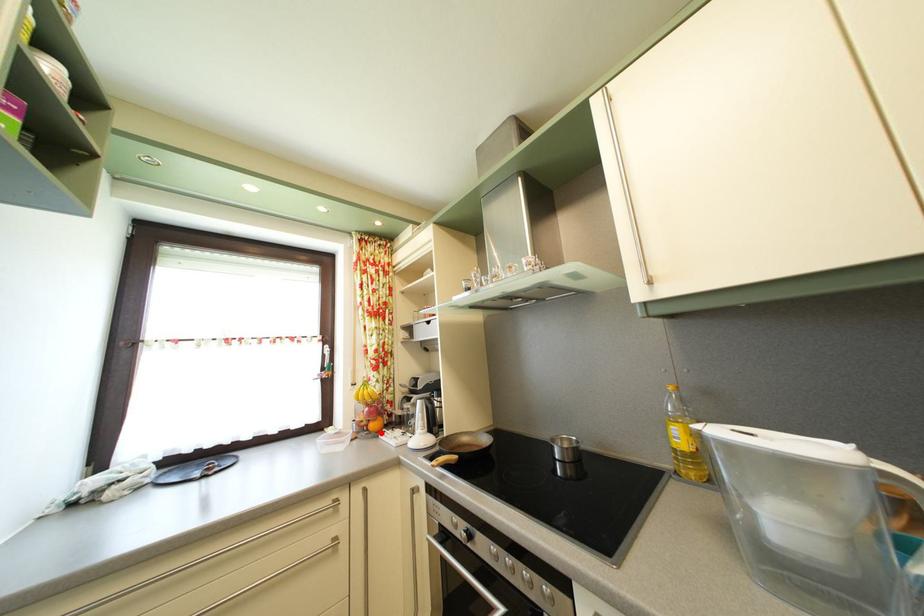
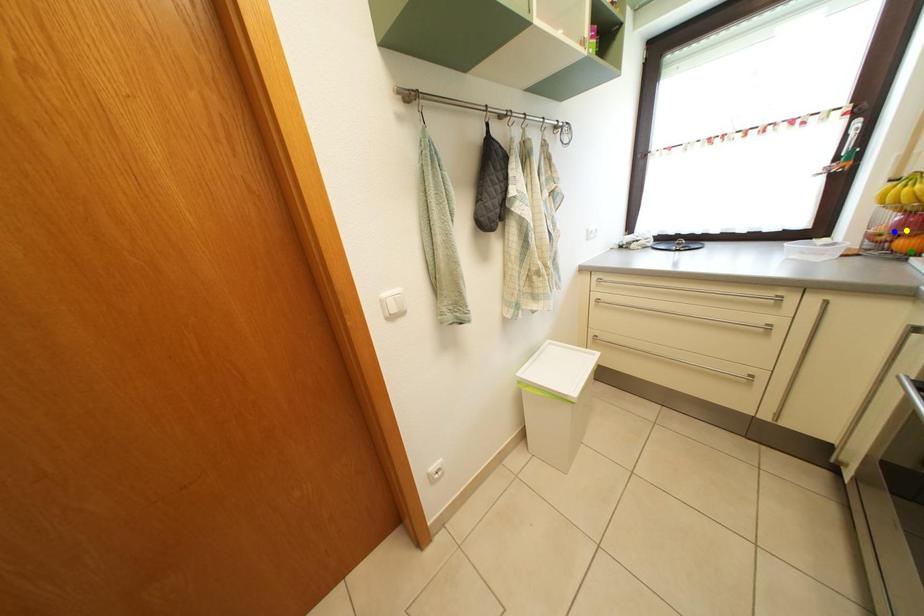
Question: I am providing you with two images of the same scene from different viewpoints. A red point is marked on the first image. You are given multiple points on the second image. Which point in image 2 represents the same 3d spot as the red point in image 1?

Choices:
 (A) blue point
 (B) green point
 (C) yellow point

Answer: (B)